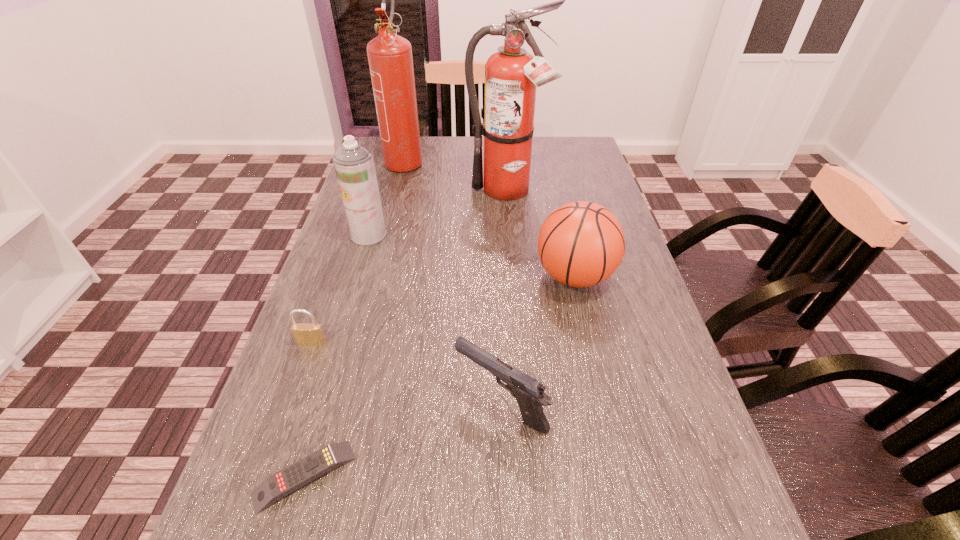
Image resolution: width=960 pixels, height=540 pixels. Find the location of `blank space at the right edge`. blank space at the right edge is located at coordinates click(x=634, y=411).

At what (x,y) coordinates should I click in order to perform the action: click on vacant area that lies between the left fire extinguisher and the nearest object. Please return your answer as a coordinate pair (x, y). This screenshot has height=540, width=960. Looking at the image, I should click on (355, 318).

In order to click on vacant space in between the right fire extinguisher and the padlock in this screenshot , I will do `click(409, 267)`.

You are a GUI agent. You are given a task and a screenshot of the screen. Output one action in this format:
    pyautogui.click(x=<x>, y=<y>)
    Task: Click on the vacant space that's between the third farthest object and the padlock
    
    Given the screenshot: What is the action you would take?
    pyautogui.click(x=340, y=288)

The height and width of the screenshot is (540, 960). In order to click on free space between the left fire extinguisher and the nearest object in this screenshot , I will do `click(355, 318)`.

The width and height of the screenshot is (960, 540). Identify the location of free area in between the padlock and the fourth farthest object. (443, 309).

Identify the location of object identified as the sixth closest to the shortest object. (390, 59).

Select which object appears as the second closest to the sixth tallest object. Please provide its 2D coordinates. Your answer should be formatted as a tuple, i.e. [(x, y)], where the tuple contains the x and y coordinates of a point satisfying the conditions above.

[(529, 393)]

Locate an element on the screen. This screenshot has height=540, width=960. free space that satisfies the following two spatial constraints: 1. from the nozzle of the right fire extinguisher; 2. on the right side of the fourth shortest object is located at coordinates (513, 276).

In order to click on blank area in the image that satisfies the following two spatial constraints: 1. on the front-facing side of the nearest object; 2. on the left side of the padlock in this screenshot , I will do `click(264, 476)`.